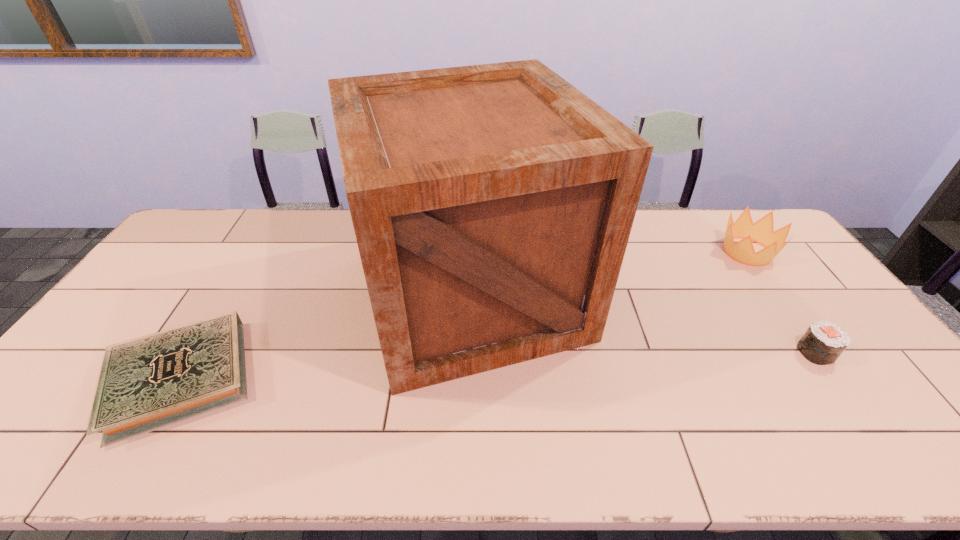
You are a GUI agent. You are given a task and a screenshot of the screen. Output one action in this format:
    pyautogui.click(x=<x>, y=<y>)
    Task: Click on the box located in the far edge section of the desktop
    The height and width of the screenshot is (540, 960).
    Given the screenshot: What is the action you would take?
    pyautogui.click(x=492, y=204)

This screenshot has width=960, height=540. I want to click on crown that is at the far edge, so click(x=762, y=232).

Where is `object at the near edge`? This screenshot has width=960, height=540. object at the near edge is located at coordinates (147, 383).

The height and width of the screenshot is (540, 960). Identify the location of object at the left edge. (147, 383).

Find the location of a particular element. Image resolution: width=960 pixels, height=540 pixels. crown at the right edge is located at coordinates (762, 232).

The width and height of the screenshot is (960, 540). In order to click on sushi that is at the right edge in this screenshot , I will do `click(823, 342)`.

At what (x,y) coordinates should I click in order to perform the action: click on object located in the near left corner section of the desktop. Please return your answer as a coordinate pair (x, y). This screenshot has width=960, height=540. Looking at the image, I should click on (147, 383).

Locate an element on the screen. object that is positioned at the far right corner is located at coordinates (762, 232).

Image resolution: width=960 pixels, height=540 pixels. Find the location of `free region at the far edge`. free region at the far edge is located at coordinates (269, 248).

In order to click on vacant space at the near edge of the desktop in this screenshot , I will do `click(226, 437)`.